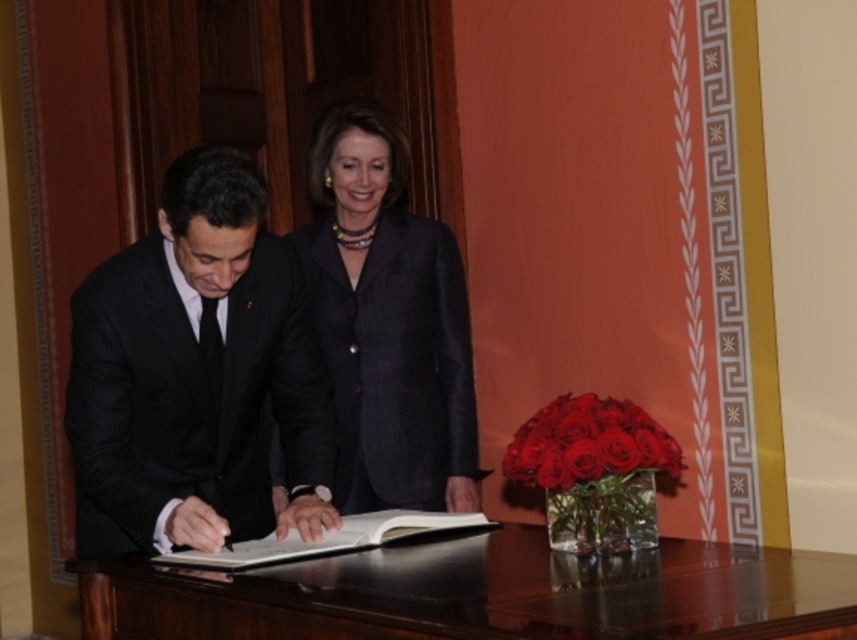
You are standing at the desk and want to place a small object between the two points labeled point (228, 406) and point (601, 476). Based on their positions, which point should the object be closer to to ensure it is in front of both?

To place the object in front of both points, it should be closer to point (601, 476) because it is in front of point (228, 406).

You are a photographer standing at the camera position. You need to place a small tripod that requires 3 feet of space to set up. Can you set it up between yourself and the shiny dark wood table at center?

The distance between the shiny dark wood table at center and the camera is 5.05 feet. Since the tripod needs 3 feet of space, there is enough space to set it up between yourself and the table.

You are standing at the origin point of the coordinate system. You need to walk to the shiny dark wood table at center. What direction should you move in?

The shiny dark wood table at center is located at point (480, 593) in the 2D coordinate system. Since you are at the origin, you should move in the positive x and positive y direction to reach it.